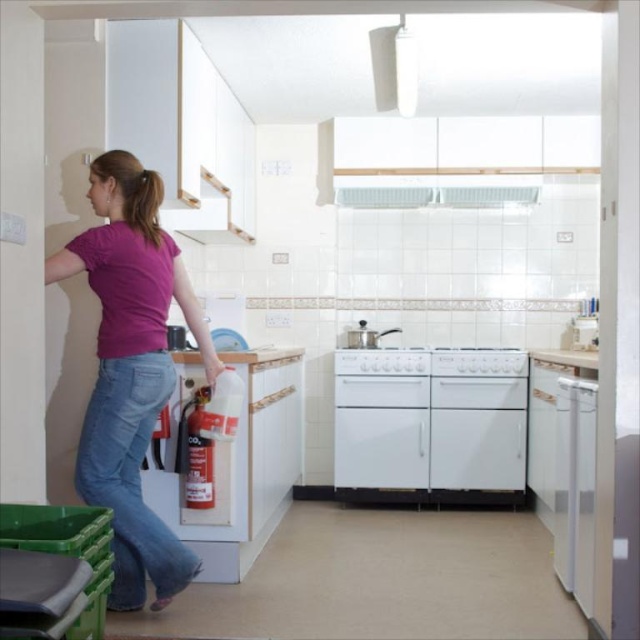
Is dark brown hair at upper left shorter than white glossy sink at center?

No, dark brown hair at upper left is not shorter than white glossy sink at center.

Who is more forward, (160, 234) or (355, 342)?

Point (160, 234) is more forward.

Image resolution: width=640 pixels, height=640 pixels. Find the location of `dark brown hair at upper left`. dark brown hair at upper left is located at coordinates point(141,198).

Find the location of a particular element. The height and width of the screenshot is (640, 640). dark brown hair at upper left is located at coordinates (141, 198).

What do you see at coordinates (131, 384) in the screenshot? This screenshot has height=640, width=640. I see `pink matte shirt at left` at bounding box center [131, 384].

Which is above, pink matte shirt at left or dark brown hair at upper left?

Positioned higher is dark brown hair at upper left.

Identify the location of pink matte shirt at left. The height and width of the screenshot is (640, 640). (131, 384).

Is white glossy stove at center above white glossy dishwasher at right?

Yes.

Is white glossy stove at center shorter than white glossy dishwasher at right?

Incorrect, white glossy stove at center's height does not fall short of white glossy dishwasher at right's.

Who is more distant from viewer, (445, 422) or (572, 486)?

The point (445, 422) is behind.

Locate an element on the screen. The image size is (640, 640). white glossy stove at center is located at coordinates (477, 420).